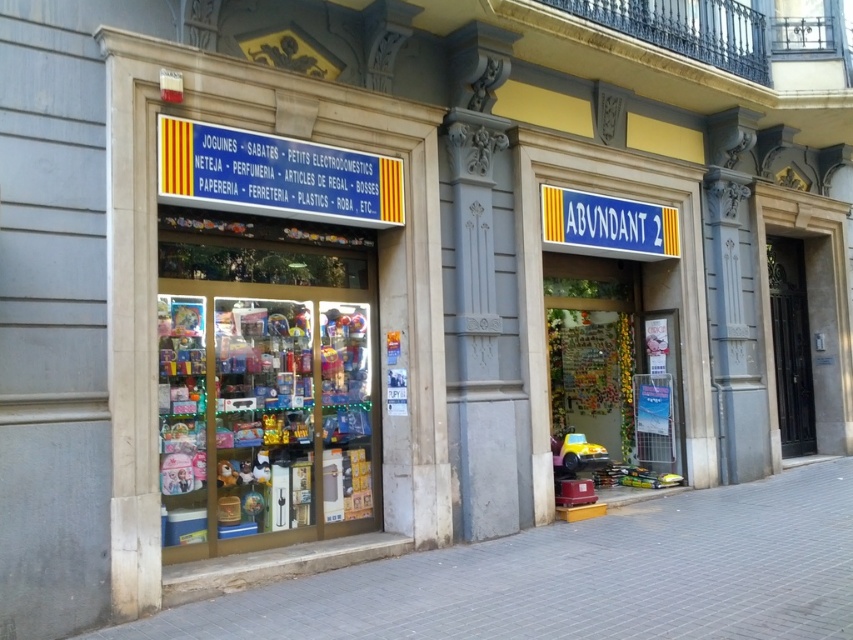
Can you confirm if yellow fabric sign at upper center is shorter than blue plastic sign at upper center?

No, yellow fabric sign at upper center is not shorter than blue plastic sign at upper center.

Is the position of yellow fabric sign at upper center more distant than that of blue plastic sign at upper center?

That is False.

Image resolution: width=853 pixels, height=640 pixels. Describe the element at coordinates (276, 176) in the screenshot. I see `yellow fabric sign at upper center` at that location.

Identify the location of yellow fabric sign at upper center. The width and height of the screenshot is (853, 640). (276, 176).

Can you confirm if gray concrete pavement at lower left is positioned to the right of blue plastic sign at upper center?

Incorrect, gray concrete pavement at lower left is not on the right side of blue plastic sign at upper center.

Is gray concrete pavement at lower left below blue plastic sign at upper center?

Yes.

The height and width of the screenshot is (640, 853). Identify the location of gray concrete pavement at lower left. (582, 577).

You are a GUI agent. You are given a task and a screenshot of the screen. Output one action in this format:
    pyautogui.click(x=<x>, y=<y>)
    Task: Click on the gray concrete pavement at lower left
    The width and height of the screenshot is (853, 640).
    Given the screenshot: What is the action you would take?
    tap(582, 577)

Is point (386, 580) less distant than point (231, 179)?

Yes.

The width and height of the screenshot is (853, 640). What do you see at coordinates (582, 577) in the screenshot? I see `gray concrete pavement at lower left` at bounding box center [582, 577].

Locate an element on the screen. gray concrete pavement at lower left is located at coordinates pos(582,577).